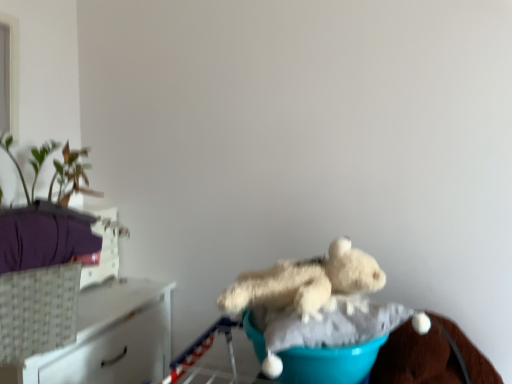
Question: Considering their positions, is fluffy white teddy bear at center located in front of or behind teal fabric at center?

Choices:
 (A) front
 (B) behind

Answer: (B)

Question: Considering the positions of point pyautogui.click(x=332, y=264) and point pyautogui.click(x=325, y=372), is point pyautogui.click(x=332, y=264) closer or farther from the camera than point pyautogui.click(x=325, y=372)?

Choices:
 (A) closer
 (B) farther

Answer: (B)

Question: Which object is the closest to the woven white basket at left?

Choices:
 (A) white woven basket at left
 (B) fluffy white teddy bear at center
 (C) teal fabric at center

Answer: (A)

Question: Considering the real-world distances, which object is closest to the fluffy white teddy bear at center?

Choices:
 (A) teal fabric at center
 (B) woven white basket at left
 (C) white woven basket at left

Answer: (A)